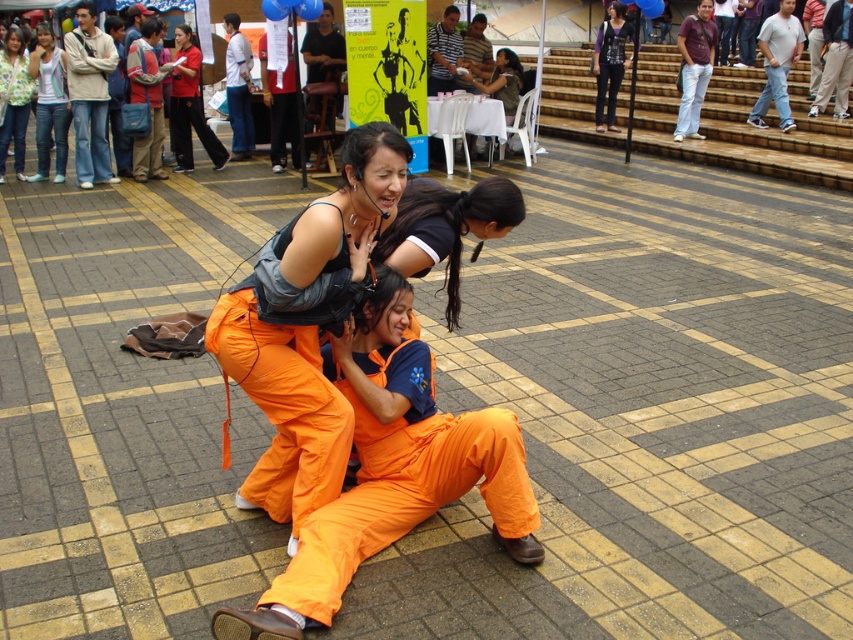
Question: Which object is farther from the camera taking this photo?

Choices:
 (A) matte black shirt at center
 (B) matte purple sweater at upper center

Answer: (B)

Question: Which object appears closest to the camera in this image?

Choices:
 (A) matte orange jumpsuit at center
 (B) orange fabric squat at center
 (C) matte purple sweater at upper center
 (D) light blue denim jeans at upper left

Answer: (B)

Question: Is light blue denim jeans at upper left bigger than matte black shirt at center?

Choices:
 (A) no
 (B) yes

Answer: (B)

Question: Can you confirm if orange fabric squat at center is positioned above matte black shirt at center?

Choices:
 (A) no
 (B) yes

Answer: (A)

Question: Is orange fabric squat at center thinner than matte green jacket at upper left?

Choices:
 (A) no
 (B) yes

Answer: (A)

Question: Which of the following is the farthest from the observer?

Choices:
 (A) matte orange jumpsuit at center
 (B) light blue denim jeans at upper left
 (C) matte black shirt at center
 (D) matte purple sweater at upper center

Answer: (D)